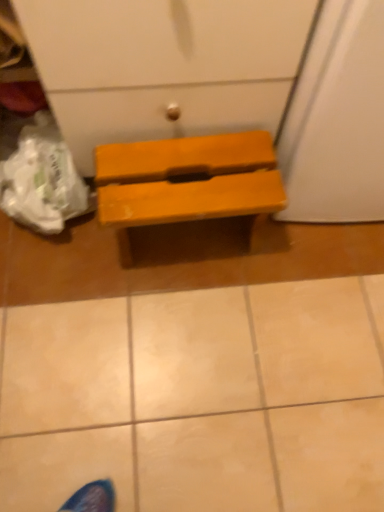
The height and width of the screenshot is (512, 384). What do you see at coordinates (199, 399) in the screenshot?
I see `wooden bench at center` at bounding box center [199, 399].

At what (x,y) coordinates should I click in order to perform the action: click on wooden bench at center. Please return your answer as a coordinate pair (x, y). Looking at the image, I should click on (199, 399).

The height and width of the screenshot is (512, 384). What do you see at coordinates (187, 182) in the screenshot?
I see `matte yellow bench at center` at bounding box center [187, 182].

In order to face matte yellow bench at center, should I rotate leftwards or rightwards?

It's best to rotate left around 0.944 degrees.

What is the approximate width of matte yellow bench at center?

The width of matte yellow bench at center is 8.94 inches.

Identify the location of matte yellow bench at center. The height and width of the screenshot is (512, 384). (187, 182).

Identify the location of wooden bench at center. The image size is (384, 512). (199, 399).

Looking at this image, does matte yellow bench at center appear on the right side of wooden bench at center?

In fact, matte yellow bench at center is to the left of wooden bench at center.

Which object is further away from the camera taking this photo, matte yellow bench at center or wooden bench at center?

matte yellow bench at center is more distant.

Considering the positions of points (210, 155) and (262, 428), is point (210, 155) farther from camera compared to point (262, 428)?

No.

From the image's perspective, is matte yellow bench at center under wooden bench at center?

Incorrect, from the image's perspective, matte yellow bench at center is higher than wooden bench at center.

From a real-world perspective, which object stands above the other?

matte yellow bench at center.

Which object is thinner, matte yellow bench at center or wooden bench at center?

With smaller width is matte yellow bench at center.

Which of these two, matte yellow bench at center or wooden bench at center, stands shorter?

Standing shorter between the two is wooden bench at center.

Considering the sizes of matte yellow bench at center and wooden bench at center in the image, is matte yellow bench at center bigger or smaller than wooden bench at center?

matte yellow bench at center is smaller than wooden bench at center.

Is matte yellow bench at center completely or partially outside of wooden bench at center?

Indeed, matte yellow bench at center is completely outside wooden bench at center.

Are matte yellow bench at center and wooden bench at center making contact?

matte yellow bench at center and wooden bench at center are clearly separated.

Is matte yellow bench at center oriented away from wooden bench at center?

No, matte yellow bench at center is not facing the opposite direction of wooden bench at center.

How different are the orientations of matte yellow bench at center and wooden bench at center in degrees?

The angle between the facing direction of matte yellow bench at center and the facing direction of wooden bench at center is 91.1 degrees.

How far apart are matte yellow bench at center and wooden bench at center?

They are 14.60 inches apart.

Where is `furniture on the left of wooden bench at center`? The image size is (384, 512). furniture on the left of wooden bench at center is located at coordinates (187, 182).

Which is more to the left, wooden bench at center or matte yellow bench at center?

matte yellow bench at center.

Considering their positions, is wooden bench at center located in front of or behind matte yellow bench at center?

wooden bench at center is positioned closer to the viewer than matte yellow bench at center.

Considering the points (276, 436) and (282, 208), which point is behind, point (276, 436) or point (282, 208)?

The point (276, 436) is more distant.

Based on the photo, from the image's perspective, which is below, wooden bench at center or matte yellow bench at center?

wooden bench at center is shown below in the image.

From a real-world perspective, between wooden bench at center and matte yellow bench at center, who is vertically lower?

From a 3D spatial view, wooden bench at center is below.

Between wooden bench at center and matte yellow bench at center, which one has smaller width?

matte yellow bench at center.

Which of these two, wooden bench at center or matte yellow bench at center, stands shorter?

Standing shorter between the two is wooden bench at center.

Considering the relative sizes of wooden bench at center and matte yellow bench at center in the image provided, is wooden bench at center bigger than matte yellow bench at center?

Indeed, wooden bench at center has a larger size compared to matte yellow bench at center.

Is wooden bench at center outside of matte yellow bench at center?

Yes.

Is wooden bench at center in contact with matte yellow bench at center?

wooden bench at center and matte yellow bench at center are clearly separated.

Is wooden bench at center oriented towards matte yellow bench at center?

No, wooden bench at center is not oriented towards matte yellow bench at center.

What's the angular difference between wooden bench at center and matte yellow bench at center's facing directions?

wooden bench at center and matte yellow bench at center are facing 91.1 degrees away from each other.

Identify the location of tile on the right of matte yellow bench at center. The width and height of the screenshot is (384, 512). (199, 399).

Locate an element on the screen. furniture positioned vertically above the wooden bench at center (from a real-world perspective) is located at coordinates (187, 182).

Locate an element on the screen. tile on the right side of matte yellow bench at center is located at coordinates (199, 399).